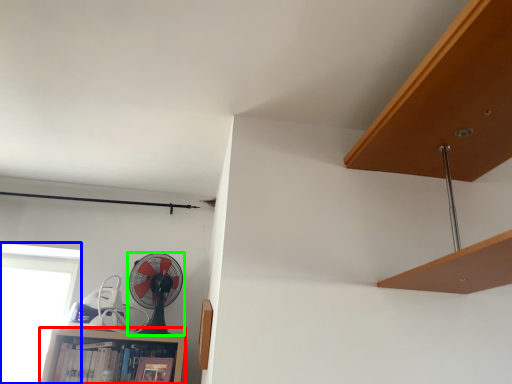
Question: Based on their relative distances, which object is farther from cabinet (highlighted by a red box)? Choose from window (highlighted by a blue box) and mechanical fan (highlighted by a green box).

Choices:
 (A) window
 (B) mechanical fan

Answer: (A)